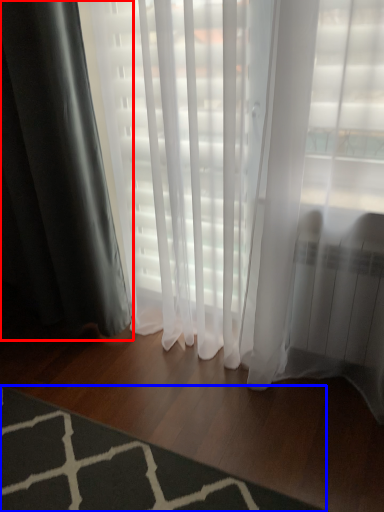
Question: Among these objects, which one is farthest to the camera, curtain (highlighted by a red box) or mat (highlighted by a blue box)?

Choices:
 (A) curtain
 (B) mat

Answer: (A)